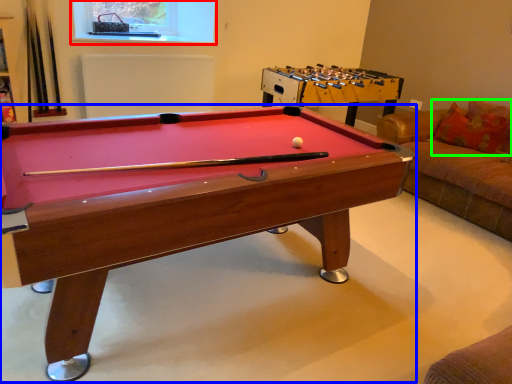
Question: Based on their relative distances, which object is farther from window screen (highlighted by a red box)? Choose from billiard table (highlighted by a blue box) and pillow (highlighted by a green box).

Choices:
 (A) billiard table
 (B) pillow

Answer: (B)